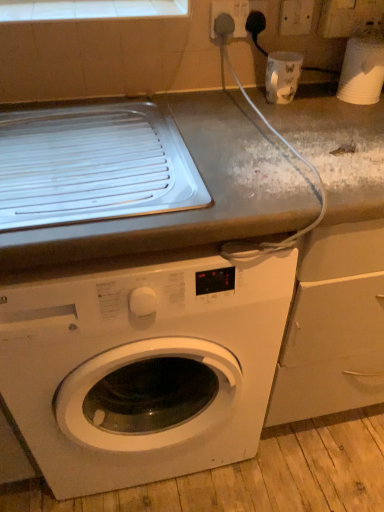
The image size is (384, 512). Find the location of `white tile at upper center`. white tile at upper center is located at coordinates (87, 9).

Measure the distance between white plastic electric outlet at upper right, which is the 2th electric outlet in left-to-right order, and camera.

white plastic electric outlet at upper right, which is the 2th electric outlet in left-to-right order, is 1.06 meters away from camera.

This screenshot has height=512, width=384. Describe the element at coordinates (296, 17) in the screenshot. I see `white plastic electric outlet at upper right, which is the 2th electric outlet in left-to-right order` at that location.

Find the location of a particular element. The height and width of the screenshot is (512, 384). white glossy cup at upper right, acting as the first appliance starting from the left is located at coordinates (282, 76).

The image size is (384, 512). What are the coordinates of `white tile at upper center` in the screenshot? It's located at (87, 9).

From the image's perspective, between white glossy washing machine at center and white plastic socket at upper right, which appears as the 2th electric outlet when viewed from the right, who is located below?

From the image's view, white glossy washing machine at center is below.

Can you confirm if white glossy washing machine at center is positioned to the left of white plastic socket at upper right, marked as the first electric outlet in a left-to-right arrangement?

Correct, you'll find white glossy washing machine at center to the left of white plastic socket at upper right, marked as the first electric outlet in a left-to-right arrangement.

Could you tell me if white glossy washing machine at center is turned towards white plastic socket at upper right, marked as the first electric outlet in a left-to-right arrangement?

No, white glossy washing machine at center is not facing towards white plastic socket at upper right, marked as the first electric outlet in a left-to-right arrangement.

Which is in front, white glossy cup at upper right, acting as the first appliance starting from the left, or white plastic cup at upper right, which appears as the first appliance when viewed from the right?

white plastic cup at upper right, which appears as the first appliance when viewed from the right, is more forward.

Could you tell me if white glossy cup at upper right, arranged as the 2th appliance when viewed from the right, is turned towards white plastic cup at upper right, the 2th appliance in the left-to-right sequence?

No, white glossy cup at upper right, arranged as the 2th appliance when viewed from the right, is not turned towards white plastic cup at upper right, the 2th appliance in the left-to-right sequence.

Which of these two, white glossy cup at upper right, arranged as the 2th appliance when viewed from the right, or white plastic cup at upper right, the 2th appliance in the left-to-right sequence, is wider?

With larger width is white glossy cup at upper right, arranged as the 2th appliance when viewed from the right.

From the image's perspective, relative to white plastic cup at upper right, which appears as the first appliance when viewed from the right, is white glossy cup at upper right, arranged as the 2th appliance when viewed from the right, above or below?

white glossy cup at upper right, arranged as the 2th appliance when viewed from the right, is situated lower than white plastic cup at upper right, which appears as the first appliance when viewed from the right, in the image.

Considering the relative sizes of white plastic cup at upper right, which appears as the first appliance when viewed from the right, and white plastic socket at upper right, marked as the first electric outlet in a left-to-right arrangement, in the image provided, is white plastic cup at upper right, which appears as the first appliance when viewed from the right, smaller than white plastic socket at upper right, marked as the first electric outlet in a left-to-right arrangement,?

No.

Considering the relative positions of white plastic cup at upper right, which appears as the first appliance when viewed from the right, and white plastic socket at upper right, which appears as the 2th electric outlet when viewed from the right, in the image provided, is white plastic cup at upper right, which appears as the first appliance when viewed from the right, to the left of white plastic socket at upper right, which appears as the 2th electric outlet when viewed from the right, from the viewer's perspective?

No, white plastic cup at upper right, which appears as the first appliance when viewed from the right, is not to the left of white plastic socket at upper right, which appears as the 2th electric outlet when viewed from the right.

Consider the image. From the image's perspective, does white plastic cup at upper right, the 2th appliance in the left-to-right sequence, appear lower than white plastic socket at upper right, marked as the first electric outlet in a left-to-right arrangement?

Yes, from the image's perspective, white plastic cup at upper right, the 2th appliance in the left-to-right sequence, is below white plastic socket at upper right, marked as the first electric outlet in a left-to-right arrangement.

From a real-world perspective, which is physically above, white plastic cup at upper right, the 2th appliance in the left-to-right sequence, or white plastic socket at upper right, marked as the first electric outlet in a left-to-right arrangement?

white plastic socket at upper right, marked as the first electric outlet in a left-to-right arrangement.

Between white glossy cup at upper right, acting as the first appliance starting from the left, and white tile at upper center, which one appears on the left side from the viewer's perspective?

white tile at upper center is more to the left.

Considering the sizes of objects white glossy cup at upper right, acting as the first appliance starting from the left, and white tile at upper center in the image provided, who is thinner, white glossy cup at upper right, acting as the first appliance starting from the left, or white tile at upper center?

white glossy cup at upper right, acting as the first appliance starting from the left.

Which of these two, white glossy cup at upper right, acting as the first appliance starting from the left, or white tile at upper center, stands taller?

white glossy cup at upper right, acting as the first appliance starting from the left.

From the image's perspective, does white glossy cup at upper right, acting as the first appliance starting from the left, appear higher than white tile at upper center?

Actually, white glossy cup at upper right, acting as the first appliance starting from the left, appears below white tile at upper center in the image.

Would you say white tile at upper center is outside white glossy cup at upper right, arranged as the 2th appliance when viewed from the right?

Absolutely, white tile at upper center is external to white glossy cup at upper right, arranged as the 2th appliance when viewed from the right.

I want to click on appliance that is the 2nd one when counting downward from the white tile at upper center (from the image's perspective), so click(282, 76).

Which of these two, white tile at upper center or white glossy cup at upper right, acting as the first appliance starting from the left, is bigger?

white glossy cup at upper right, acting as the first appliance starting from the left, is bigger.

Based on the photo, is white tile at upper center to the left or to the right of white glossy cup at upper right, acting as the first appliance starting from the left, in the image?

white tile at upper center is to the left of white glossy cup at upper right, acting as the first appliance starting from the left.

Where is `the 2nd electric outlet behind the white glossy washing machine at center, counting from the anchor's position`? the 2nd electric outlet behind the white glossy washing machine at center, counting from the anchor's position is located at coordinates (296, 17).

Would you say white plastic electric outlet at upper right, which is the 2th electric outlet in left-to-right order, is part of white glossy washing machine at center's contents?

No, white plastic electric outlet at upper right, which is the 2th electric outlet in left-to-right order, is not inside white glossy washing machine at center.

Does white glossy washing machine at center touch white plastic electric outlet at upper right, which is the first electric outlet from right to left?

No, white glossy washing machine at center is not with white plastic electric outlet at upper right, which is the first electric outlet from right to left.

Considering the relative sizes of white glossy washing machine at center and white plastic electric outlet at upper right, which is the 2th electric outlet in left-to-right order, in the image provided, is white glossy washing machine at center wider than white plastic electric outlet at upper right, which is the 2th electric outlet in left-to-right order,?

Indeed, white glossy washing machine at center has a greater width compared to white plastic electric outlet at upper right, which is the 2th electric outlet in left-to-right order.

Image resolution: width=384 pixels, height=512 pixels. Find the location of `window sill lying on the left of white glossy washing machine at center`. window sill lying on the left of white glossy washing machine at center is located at coordinates (87, 9).

Considering the sizes of objects white glossy washing machine at center and white tile at upper center in the image provided, who is smaller, white glossy washing machine at center or white tile at upper center?

Smaller between the two is white tile at upper center.

Is white glossy washing machine at center with white tile at upper center?

They are not placed beside each other.

Where is `washing machine located in front of the white plastic socket at upper right, which appears as the 2th electric outlet when viewed from the right`? The height and width of the screenshot is (512, 384). washing machine located in front of the white plastic socket at upper right, which appears as the 2th electric outlet when viewed from the right is located at coordinates (143, 367).

You are a GUI agent. You are given a task and a screenshot of the screen. Output one action in this format:
    pyautogui.click(x=<x>, y=<y>)
    Task: Click on the appliance directly beneath the white plastic cup at upper right, which appears as the first appliance when viewed from the right (from a real-world perspective)
    
    Given the screenshot: What is the action you would take?
    pyautogui.click(x=282, y=76)

Which object lies further to the anchor point white tile at upper center, white plastic cup at upper right, which appears as the first appliance when viewed from the right, or white plastic socket at upper right, marked as the first electric outlet in a left-to-right arrangement?

Among the two, white plastic cup at upper right, which appears as the first appliance when viewed from the right, is located further to white tile at upper center.

Based on their spatial positions, is white glossy cup at upper right, arranged as the 2th appliance when viewed from the right, or white plastic electric outlet at upper right, which is the first electric outlet from right to left, closer to white plastic cup at upper right, which appears as the first appliance when viewed from the right?

white glossy cup at upper right, arranged as the 2th appliance when viewed from the right.

Looking at the image, which one is located closer to white glossy washing machine at center, white plastic cup at upper right, the 2th appliance in the left-to-right sequence, or white plastic electric outlet at upper right, which is the first electric outlet from right to left?

Among the two, white plastic cup at upper right, the 2th appliance in the left-to-right sequence, is located nearer to white glossy washing machine at center.

Estimate the real-world distances between objects in this image. Which object is closer to white plastic cup at upper right, which appears as the first appliance when viewed from the right, white plastic electric outlet at upper right, which is the first electric outlet from right to left, or white plastic socket at upper right, marked as the first electric outlet in a left-to-right arrangement?

The object closer to white plastic cup at upper right, which appears as the first appliance when viewed from the right, is white plastic electric outlet at upper right, which is the first electric outlet from right to left.

Estimate the real-world distances between objects in this image. Which object is closer to white plastic cup at upper right, which appears as the first appliance when viewed from the right, white plastic socket at upper right, marked as the first electric outlet in a left-to-right arrangement, or white glossy washing machine at center?

The object closer to white plastic cup at upper right, which appears as the first appliance when viewed from the right, is white plastic socket at upper right, marked as the first electric outlet in a left-to-right arrangement.

Based on the photo, estimate the real-world distances between objects in this image. Which object is further from white plastic socket at upper right, which appears as the 2th electric outlet when viewed from the right, white tile at upper center or white plastic electric outlet at upper right, which is the 2th electric outlet in left-to-right order?

white tile at upper center.

Considering their positions, is white plastic cup at upper right, the 2th appliance in the left-to-right sequence, positioned further to white plastic electric outlet at upper right, which is the first electric outlet from right to left, than white glossy washing machine at center?

white glossy washing machine at center.

From the image, which object appears to be farther from white glossy cup at upper right, acting as the first appliance starting from the left, white plastic cup at upper right, the 2th appliance in the left-to-right sequence, or white tile at upper center?

Based on the image, white tile at upper center appears to be further to white glossy cup at upper right, acting as the first appliance starting from the left.

The width and height of the screenshot is (384, 512). What are the coordinates of `electric outlet located between white tile at upper center and white plastic electric outlet at upper right, which is the first electric outlet from right to left, in the left-right direction` in the screenshot? It's located at (230, 15).

Where is `appliance between white plastic socket at upper right, which appears as the 2th electric outlet when viewed from the right, and white plastic cup at upper right, the 2th appliance in the left-to-right sequence`? This screenshot has height=512, width=384. appliance between white plastic socket at upper right, which appears as the 2th electric outlet when viewed from the right, and white plastic cup at upper right, the 2th appliance in the left-to-right sequence is located at coordinates (282, 76).

This screenshot has width=384, height=512. I want to click on appliance that lies between white plastic cup at upper right, the 2th appliance in the left-to-right sequence, and white glossy washing machine at center from top to bottom, so click(282, 76).

Identify the location of electric outlet that lies between white plastic electric outlet at upper right, which is the first electric outlet from right to left, and white glossy cup at upper right, arranged as the 2th appliance when viewed from the right, from top to bottom. This screenshot has height=512, width=384. (230, 15).